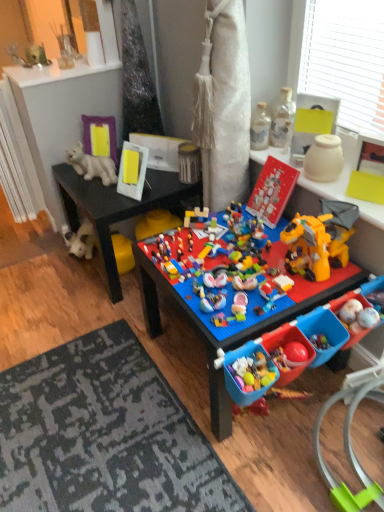
Image resolution: width=384 pixels, height=512 pixels. I want to click on vacant space underneath brick-like plastic lego set at center, which is counted as the fourth toy, starting from the left (from a real-world perspective), so click(226, 258).